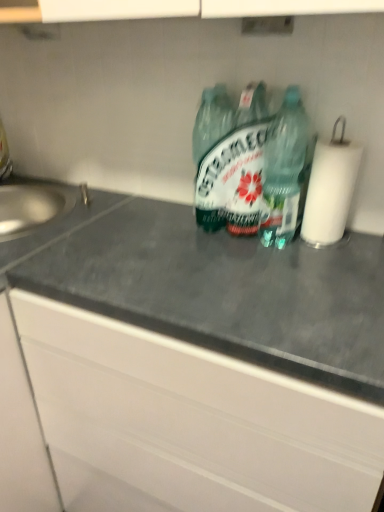
Where is `vacant space to the right of green translucent bottle at center, which appears as the second bottle when viewed from the left`? Image resolution: width=384 pixels, height=512 pixels. vacant space to the right of green translucent bottle at center, which appears as the second bottle when viewed from the left is located at coordinates (355, 251).